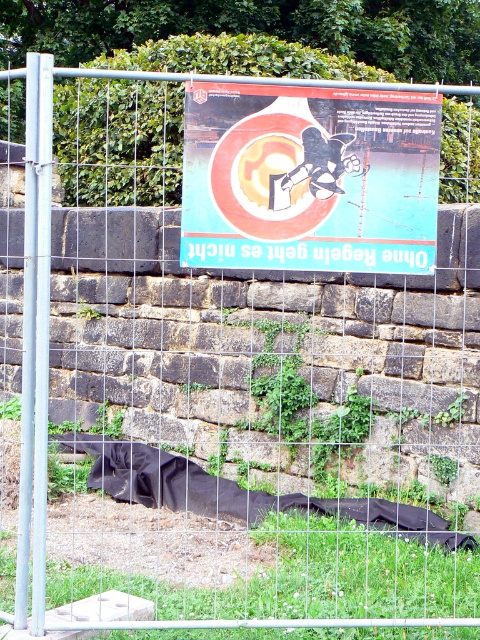
You are standing in front of the construction area fence. There is a point marked at coordinates (x=309, y=179). What object is located at this point?

The point at coordinates (x=309, y=179) marks the teal paper poster at center.

You are an event organizer planning to place a new rectangular banner between the teal paper poster at center and the black fabric blanket at lower left. The banner must be wider than both existing items. Is this possible given their current widths?

The teal paper poster at center is narrower than the black fabric blanket at lower left. Since the banner needs to be wider than both, it must exceed the width of the black fabric blanket at lower left, which is the wider of the two. This is possible as long as the banner is wider than the black fabric blanket at lower left.

You are a delivery person who needs to place a package on the ground near the teal paper poster at center without stepping on the black fabric blanket at lower left. Where should you place the package?

The teal paper poster at center is above the black fabric blanket at lower left, so you should place the package on the ground near the teal paper poster at center but below it to avoid stepping on the black fabric blanket at lower left.